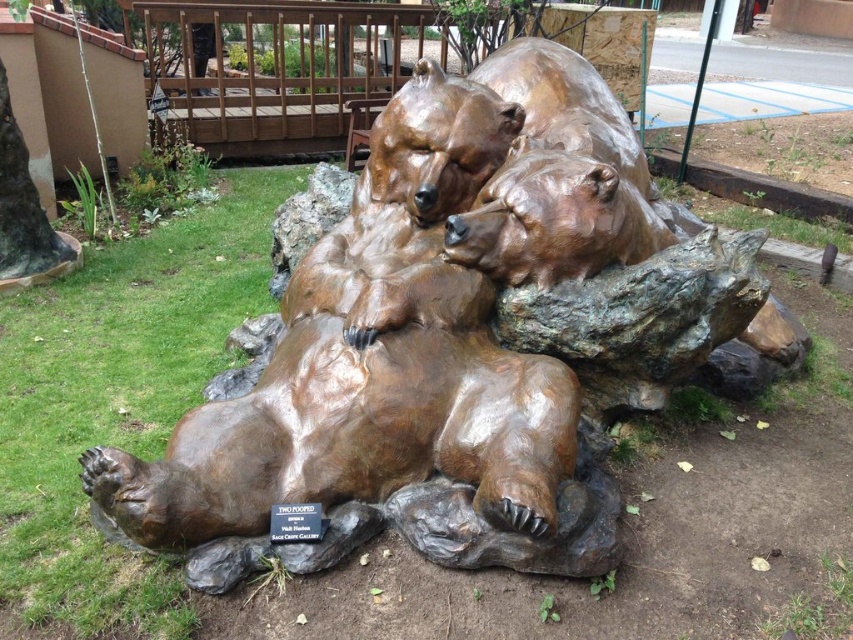
In the scene shown: You are a visitor at a park and want to take a photo of the bronze bear sculpture at center and the bronze bear at center. Which one should you zoom in on to capture more details of its texture?

The bronze bear sculpture at center is larger in size than the bronze bear at center, so zooming in on the bronze bear sculpture at center will allow you to capture more details of its texture.

You are a visitor at a park and want to take a photo of the bronze bear sculpture at center and the bronze bear at center. Which one should you focus on if you want to capture the taller object in your shot?

The bronze bear sculpture at center is much taller than the bronze bear at center, so you should focus on the bronze bear sculpture at center to capture the taller object in your shot.